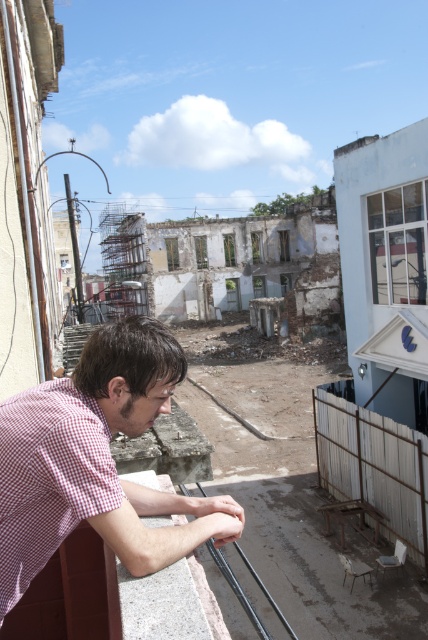
Question: Is red checkered shirt at lower left in front of metal/smooth rail at lower center?

Choices:
 (A) no
 (B) yes

Answer: (B)

Question: Which of the following is the farthest from the observer?

Choices:
 (A) metal/smooth rail at lower center
 (B) gray concrete ledge at lower left
 (C) red checkered shirt at lower left

Answer: (A)

Question: Among these objects, which one is farthest from the camera?

Choices:
 (A) gray concrete ledge at lower left
 (B) red checkered shirt at lower left
 (C) metal/smooth rail at lower center

Answer: (C)

Question: Can you confirm if red checkered shirt at lower left is positioned below gray concrete ledge at lower left?

Choices:
 (A) yes
 (B) no

Answer: (B)

Question: Which point is farther to the camera?

Choices:
 (A) (219, 557)
 (B) (226, 536)
 (C) (169, 579)

Answer: (A)

Question: Can you confirm if red checkered shirt at lower left is wider than metal/smooth rail at lower center?

Choices:
 (A) yes
 (B) no

Answer: (B)